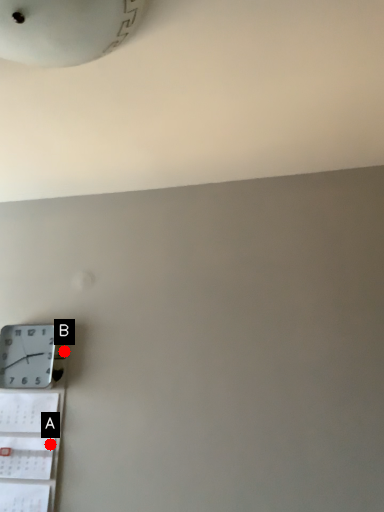
Question: Two points are circled on the image, labeled by A and B beside each circle. Which of the following is the farthest from the observer?

Choices:
 (A) A is further
 (B) B is further

Answer: (B)